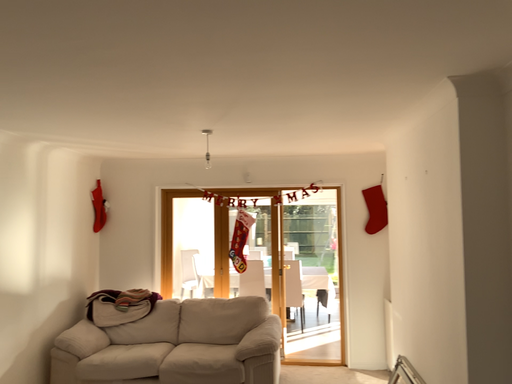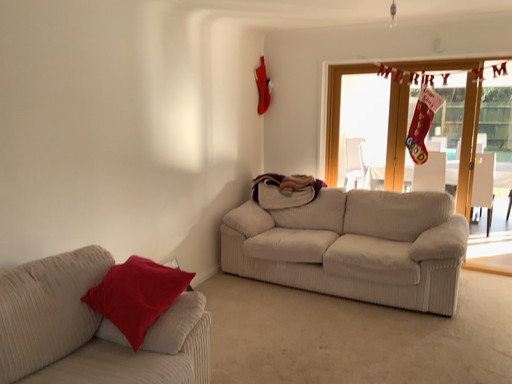
Question: How did the camera likely rotate when shooting the video?

Choices:
 (A) rotated right
 (B) rotated left

Answer: (B)